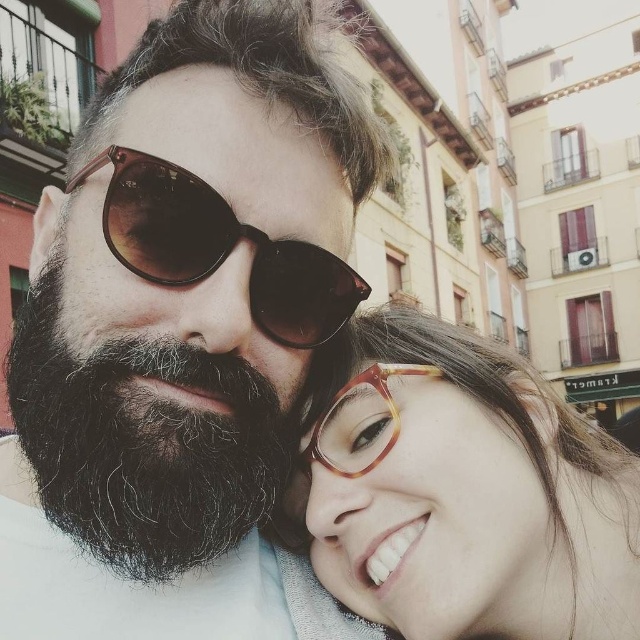
Is point (525, 556) farther from camera compared to point (339, 470)?

That is False.

Who is more forward, [417,512] or [332,461]?

Point [417,512] is in front.

Does point (520, 560) lie in front of point (387, 390)?

No, it is behind (387, 390).

Identify the location of tortoiseshell glasses at lower right. The image size is (640, 640). (461, 492).

Between matte black sunglasses at center and black fuzzy beard at center, which one is positioned lower?

black fuzzy beard at center is lower down.

Which is behind, point (168, 560) or point (104, 492)?

The point (168, 560) is more distant.

Who is more distant from viewer, (x=13, y=412) or (x=109, y=435)?

Positioned behind is point (x=13, y=412).

The height and width of the screenshot is (640, 640). Find the location of `matte black sunglasses at center`. matte black sunglasses at center is located at coordinates (180, 328).

Which is more to the left, black fuzzy beard at center or translucent tortoiseshell glasses at center?

black fuzzy beard at center is more to the left.

The image size is (640, 640). What do you see at coordinates (141, 444) in the screenshot?
I see `black fuzzy beard at center` at bounding box center [141, 444].

Locate an element on the screen. The height and width of the screenshot is (640, 640). black fuzzy beard at center is located at coordinates (141, 444).